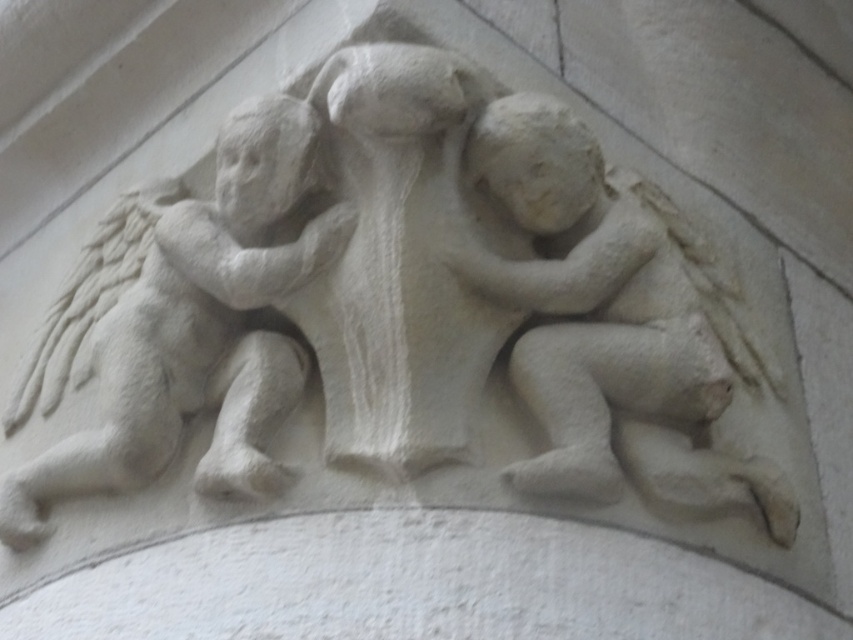
Question: Is white stone cherub at center positioned before white stone cherub at upper left?

Choices:
 (A) no
 (B) yes

Answer: (B)

Question: Which object appears farthest from the camera in this image?

Choices:
 (A) white stone cherub at center
 (B) white stone cherub at upper left

Answer: (B)

Question: Among these points, which one is nearest to the camera?

Choices:
 (A) (247, 252)
 (B) (525, 228)

Answer: (A)

Question: Can you confirm if white stone cherub at center is positioned to the right of white stone cherub at upper left?

Choices:
 (A) yes
 (B) no

Answer: (A)

Question: Among these points, which one is nearest to the camera?

Choices:
 (A) pos(236,285)
 (B) pos(688,355)

Answer: (B)

Question: In this image, where is white stone cherub at center located relative to white stone cherub at upper left?

Choices:
 (A) right
 (B) left

Answer: (A)